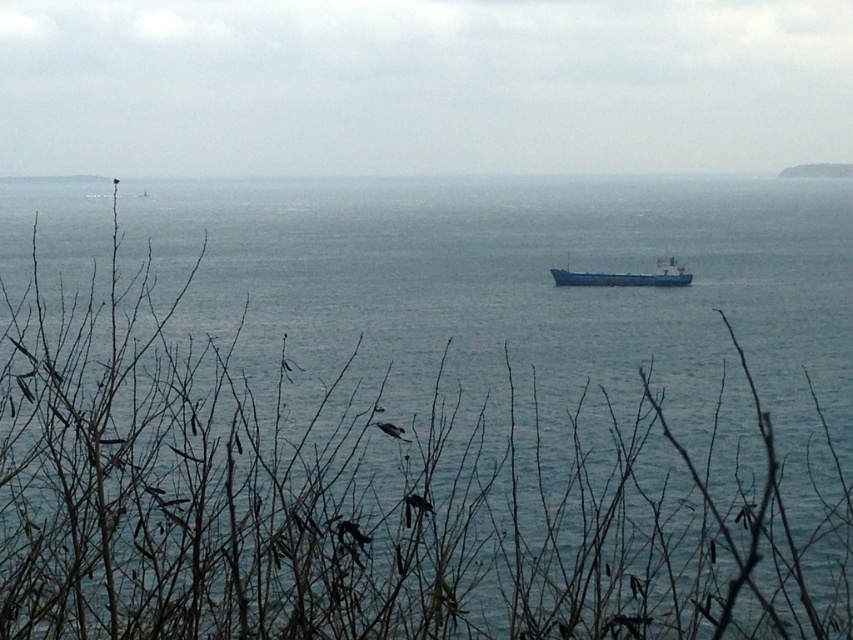
Can you confirm if blue matte water at center is smaller than blue matte cargo ship at center?

No, blue matte water at center is not smaller than blue matte cargo ship at center.

Can you confirm if blue matte water at center is bigger than blue matte cargo ship at center?

Correct, blue matte water at center is larger in size than blue matte cargo ship at center.

Does point (656, 525) come in front of point (595, 284)?

Yes.

The width and height of the screenshot is (853, 640). What are the coordinates of `blue matte water at center` in the screenshot? It's located at (424, 420).